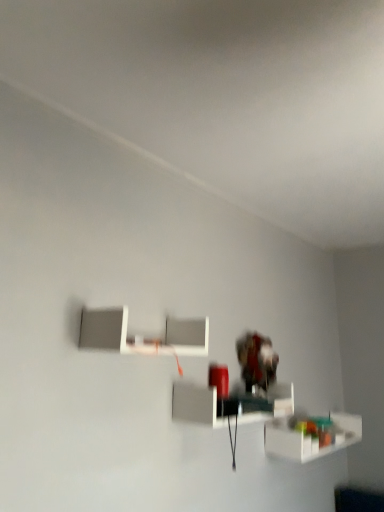
Question: From a real-world perspective, is translucent plastic shelf at lower right, arranged as the 3th shelf when viewed from the left, above or below white glossy shelf at center, which is counted as the second shelf, starting from the bottom?

Choices:
 (A) below
 (B) above

Answer: (A)

Question: Does point (334, 421) appear closer or farther from the camera than point (235, 411)?

Choices:
 (A) closer
 (B) farther

Answer: (B)

Question: Estimate the real-world distances between objects in this image. Which object is farther from the white glossy shelf at center, which appears as the second shelf when viewed from the top?

Choices:
 (A) translucent plastic shelf at lower right, placed as the first shelf when sorted from bottom to top
 (B) white matte shelf at upper center, which is the 3th shelf in right-to-left order

Answer: (A)

Question: Which is nearer to the white glossy shelf at center, arranged as the 2th shelf when viewed from the right?

Choices:
 (A) white matte shelf at upper center, which is the 3th shelf in right-to-left order
 (B) translucent plastic shelf at lower right, positioned as the third shelf in top-to-bottom order

Answer: (A)